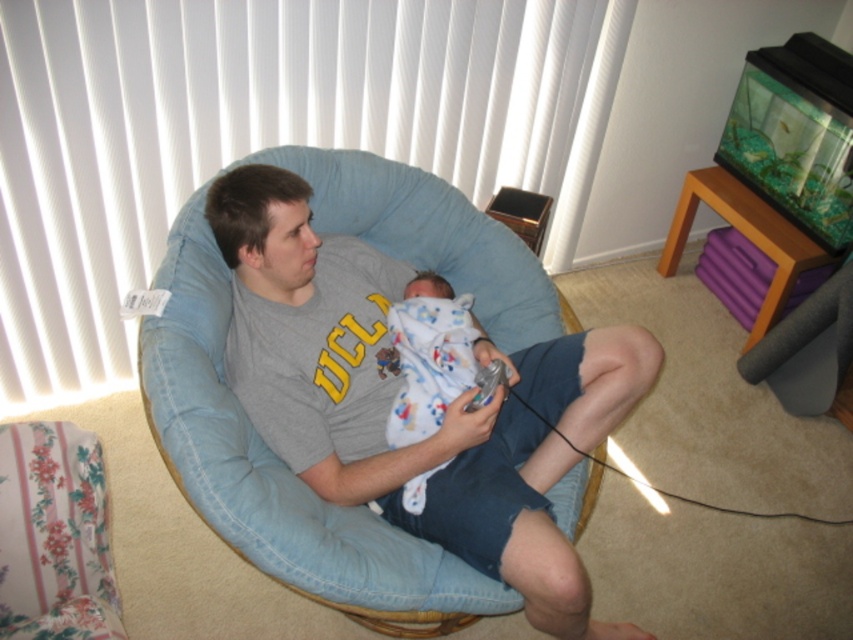
Based on the photo, can you confirm if denim blue chair at center is smaller than white cotton swaddle at center?

No.

At what (x,y) coordinates should I click in order to perform the action: click on denim blue chair at center. Please return your answer as a coordinate pair (x, y). This screenshot has height=640, width=853. Looking at the image, I should click on (383, 403).

Where is `denim blue chair at center`? denim blue chair at center is located at coordinates (383, 403).

Between white cotton swaddle at center and clear plastic game controller at lower center, which one has less height?

Standing shorter between the two is clear plastic game controller at lower center.

Between point (509, 374) and point (480, 372), which one is positioned behind?

The point (509, 374) is more distant.

Between point (419, 422) and point (498, 364), which one is positioned behind?

The point (419, 422) is behind.

You are a GUI agent. You are given a task and a screenshot of the screen. Output one action in this format:
    pyautogui.click(x=<x>, y=<y>)
    Task: Click on the white cotton swaddle at center
    
    Given the screenshot: What is the action you would take?
    pyautogui.click(x=434, y=358)

Who is taller, denim blue chair at center or clear plastic game controller at lower center?

Standing taller between the two is denim blue chair at center.

Does denim blue chair at center have a larger size compared to clear plastic game controller at lower center?

Yes.

Who is more forward, (503, 400) or (474, 384)?

Point (503, 400) is in front.

Identify the location of denim blue chair at center. The image size is (853, 640). (383, 403).